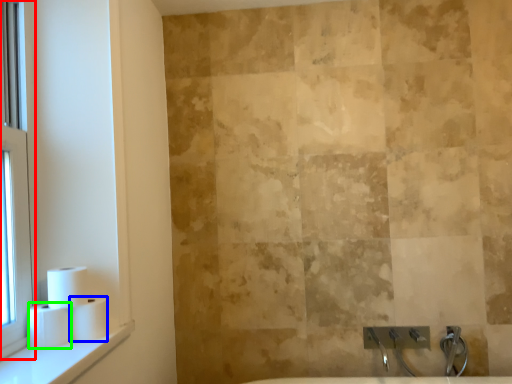
Question: Which object is the closest to the window (highlighted by a red box)? Choose among these: toilet paper (highlighted by a blue box) or toilet paper (highlighted by a green box).

Choices:
 (A) toilet paper
 (B) toilet paper

Answer: (B)